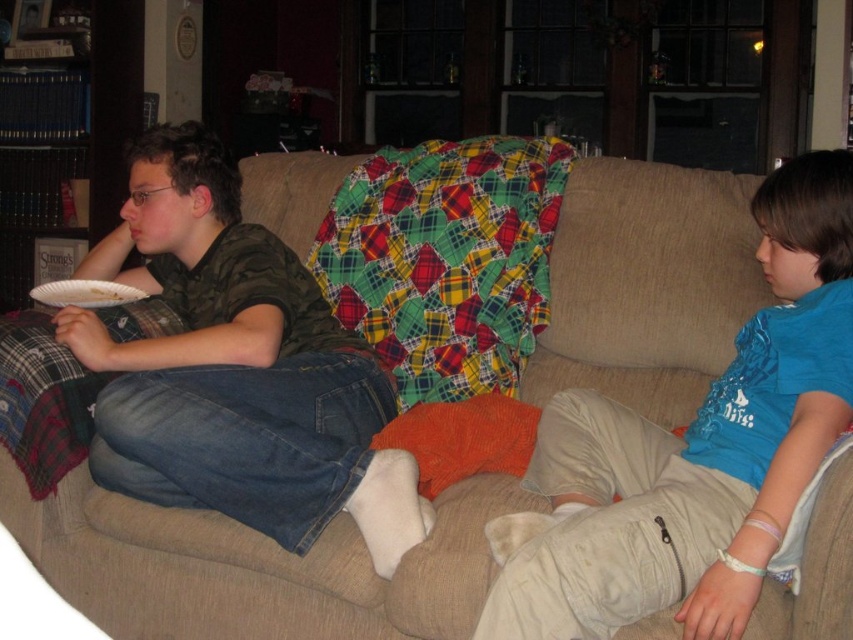
You are standing in the living room and want to place a small plant between the two points, point (281, 397) and point (47, 282). Which point should the plant be closer to in order to be nearer to the viewer?

The plant should be placed closer to point (281, 397) because it is nearer to the viewer compared to point (47, 282).

In the scene shown: You are organizing a clothing donation drive and need to determine which of the two shirts, the blue cotton shirt at right or the matte green shirt at left, takes up more space when folded. Based on the image, which shirt should you allocate more storage space for?

The matte green shirt at left takes up more space than the blue cotton shirt at right, so you should allocate more storage space for the matte green shirt at left.

In the scene shown: You are planning to place a new decorative item on the couch in the living room. The item you have is exactly the same size as the blue cotton shirt at right. Will it fit on the space where the white paper plate at left is currently placed?

The blue cotton shirt at right is bigger than the white paper plate at left, so the new decorative item, which is the same size as the blue cotton shirt at right, will not fit in the space where the white paper plate at left is placed because it is larger.